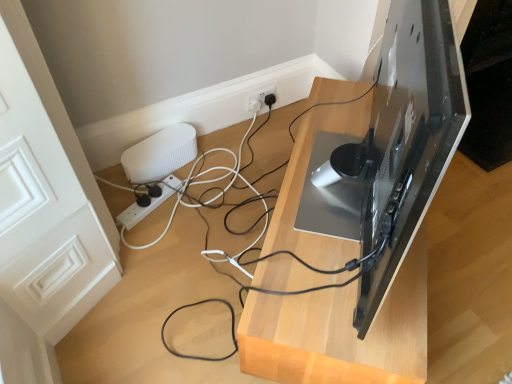
Identify the location of free spot to the right of white plastic power strip at lower center. This screenshot has width=512, height=384. (193, 209).